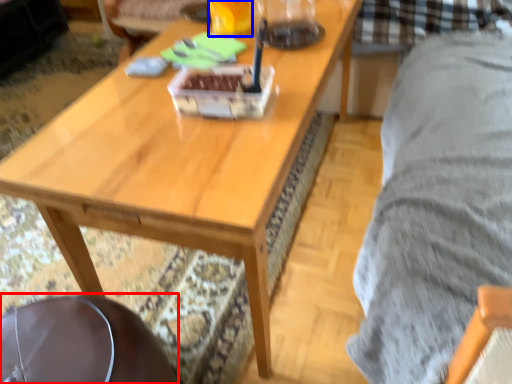
Question: Among these objects, which one is farthest to the camera, swivel chair (highlighted by a red box) or beverage (highlighted by a blue box)?

Choices:
 (A) swivel chair
 (B) beverage

Answer: (B)